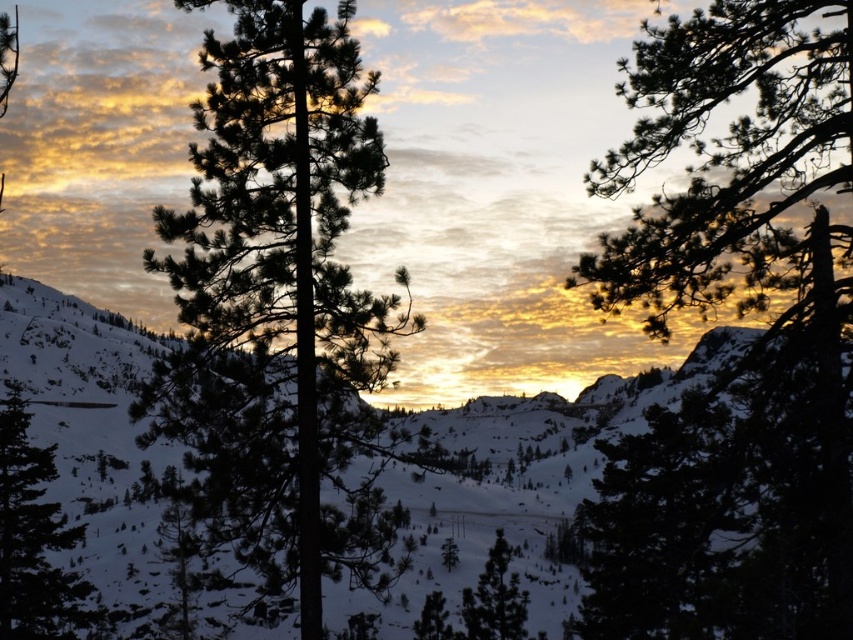
Does green textured pine tree at upper right appear on the left side of green matte tree at center?

No, green textured pine tree at upper right is not to the left of green matte tree at center.

Does green textured pine tree at upper right have a larger size compared to green matte tree at center?

Indeed, green textured pine tree at upper right has a larger size compared to green matte tree at center.

Between point (622, 628) and point (508, 580), which one is positioned in front?

Point (622, 628) is in front.

You are a GUI agent. You are given a task and a screenshot of the screen. Output one action in this format:
    pyautogui.click(x=<x>, y=<y>)
    Task: Click on the green textured pine tree at upper right
    This screenshot has width=853, height=640.
    Given the screenshot: What is the action you would take?
    pyautogui.click(x=746, y=353)

Is green textured pine tree at upper right shorter than dark green pine tree at center?

No.

Does point (674, 118) lie in front of point (300, 540)?

No, (674, 118) is further to viewer.

Identify the location of green textured pine tree at upper right. (746, 353).

Between green textured pine tree at upper right and green matte tree at lower left, which one is positioned lower?

green matte tree at lower left is below.

Which is in front, point (778, 19) or point (22, 428)?

Positioned in front is point (778, 19).

Identify the location of green textured pine tree at upper right. (746, 353).